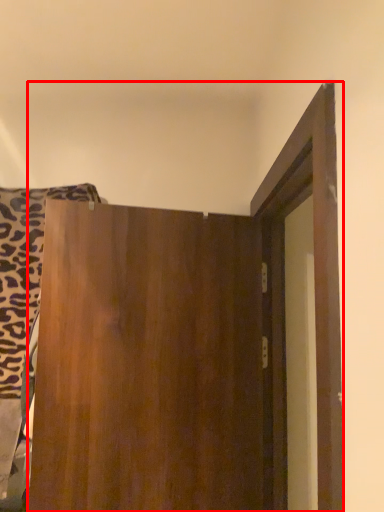
Question: From the image's perspective, what is the correct spatial positioning of door (annotated by the red box) in reference to laundry?

Choices:
 (A) below
 (B) above

Answer: (A)